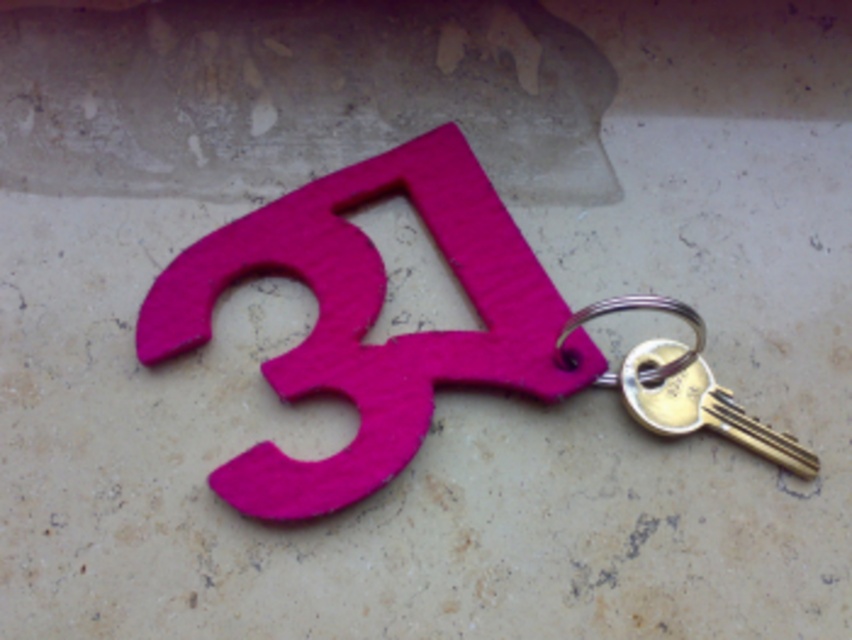
You are holding a matte pink keychain at center and a gold metallic key at center. If you want to attach the key to the keychain, which one should you connect the key to?

The matte pink keychain at center is above the gold metallic key at center, so you should connect the gold metallic key at center to the matte pink keychain at center.